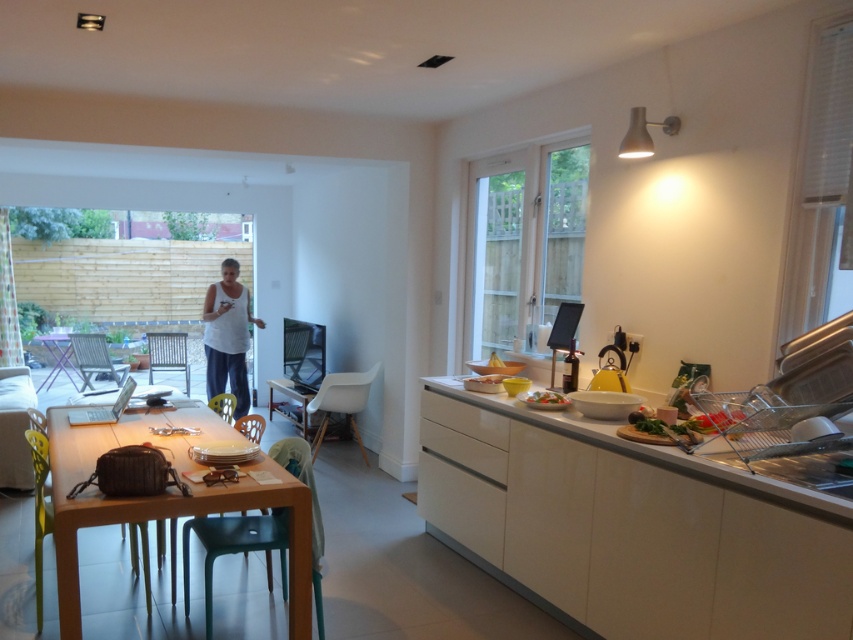
Does point (511, 198) come farther from viewer compared to point (108, 435)?

Yes, it is behind point (108, 435).

Between transparent plastic glass door at upper right and wooden table at center, which one appears on the left side from the viewer's perspective?

Positioned to the left is wooden table at center.

Who is more forward, (572, 228) or (184, 509)?

Point (184, 509) is in front.

What are the coordinates of `transparent plastic glass door at upper right` in the screenshot? It's located at (525, 243).

Does wooden table at center have a greater width compared to white cotton shirt at center?

Correct, the width of wooden table at center exceeds that of white cotton shirt at center.

The height and width of the screenshot is (640, 853). What do you see at coordinates (164, 499) in the screenshot?
I see `wooden table at center` at bounding box center [164, 499].

The image size is (853, 640). What do you see at coordinates (164, 499) in the screenshot?
I see `wooden table at center` at bounding box center [164, 499].

The width and height of the screenshot is (853, 640). Find the location of `wooden table at center`. wooden table at center is located at coordinates (164, 499).

Can you confirm if white glossy counter top at right is positioned to the right of transparent plastic glass door at upper right?

Yes, white glossy counter top at right is to the right of transparent plastic glass door at upper right.

Can you confirm if white glossy counter top at right is shorter than transparent plastic glass door at upper right?

Correct, white glossy counter top at right is not as tall as transparent plastic glass door at upper right.

Is point (570, 579) in front of point (502, 188)?

Yes, point (570, 579) is closer to viewer.

The height and width of the screenshot is (640, 853). I want to click on white glossy counter top at right, so click(x=630, y=525).